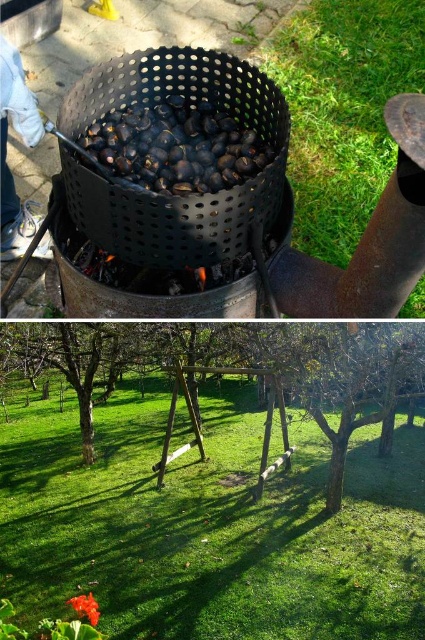
Is black matte chestnuts at center to the left of smooth glossy flower at lower left from the viewer's perspective?

Incorrect, black matte chestnuts at center is not on the left side of smooth glossy flower at lower left.

Is black matte chestnuts at center above smooth glossy flower at lower left?

Yes.

The height and width of the screenshot is (640, 425). What do you see at coordinates (175, 147) in the screenshot? I see `black matte chestnuts at center` at bounding box center [175, 147].

This screenshot has width=425, height=640. What are the coordinates of `black matte chestnuts at center` in the screenshot? It's located at (175, 147).